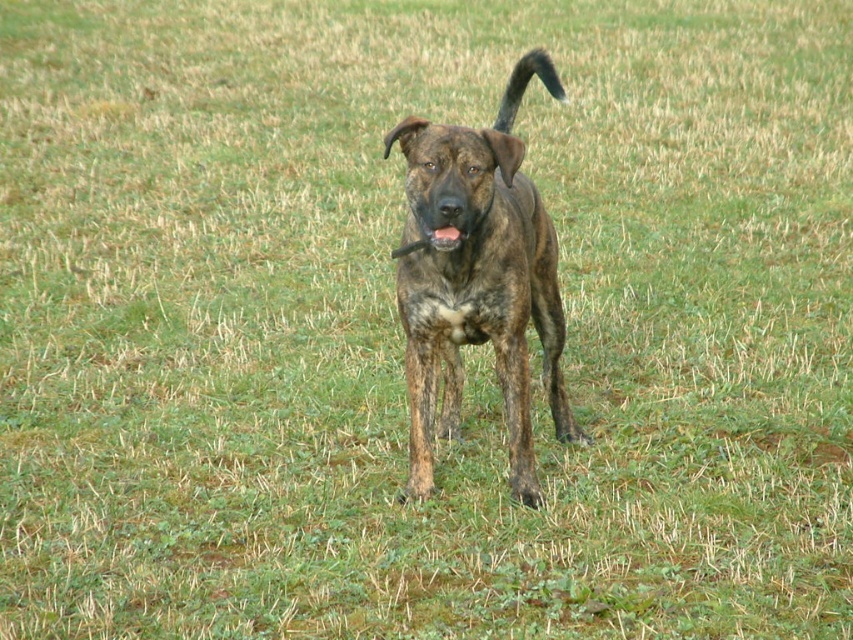
You are a dog owner who wants to take both the brindle fur dog at center and the brown brindle dog at center for a walk. Which dog requires a longer leash to accommodate its size?

The brindle fur dog at center requires a longer leash because it is larger in size than the brown brindle dog at center.

You are a photographer trying to capture the brindle fur dog at center and the brown brindle tail at upper right in a single frame. Based on their sizes, which one should you focus on to ensure both fit in the photo?

The brindle fur dog at center is smaller than the brown brindle tail at upper right, so focusing on the brown brindle tail at upper right would help ensure both fit in the frame since it takes up more space.